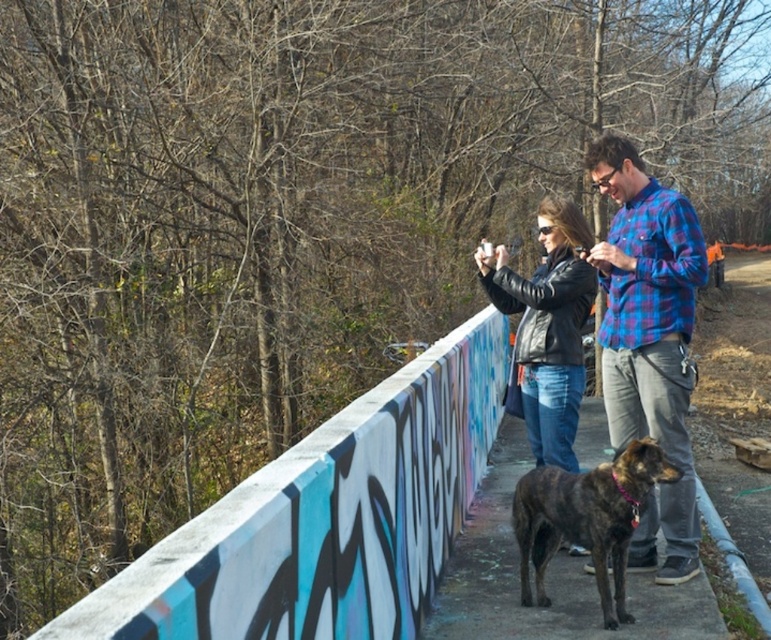
Question: Which object appears farthest from the camera in this image?

Choices:
 (A) black leather jacket at center
 (B) brown textured pavement at lower center

Answer: (A)

Question: Can you confirm if plaid flannel shirt at center is thinner than black leather jacket at center?

Choices:
 (A) yes
 (B) no

Answer: (A)

Question: Based on their relative distances, which object is nearer to the brindle fur dog at lower center?

Choices:
 (A) black leather jacket at center
 (B) plaid flannel shirt at center

Answer: (B)

Question: Can you confirm if plaid flannel shirt at center is smaller than black leather jacket at center?

Choices:
 (A) no
 (B) yes

Answer: (A)

Question: From the image, what is the correct spatial relationship of plaid flannel shirt at center in relation to brindle fur dog at lower center?

Choices:
 (A) right
 (B) left

Answer: (A)

Question: Among these points, which one is farthest from the camera?

Choices:
 (A) (527, 632)
 (B) (557, 216)

Answer: (B)